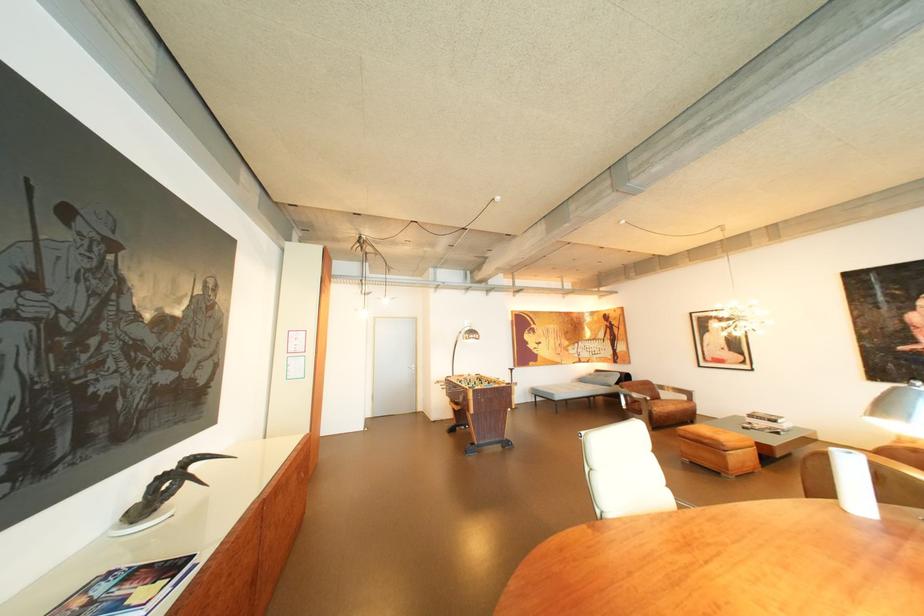
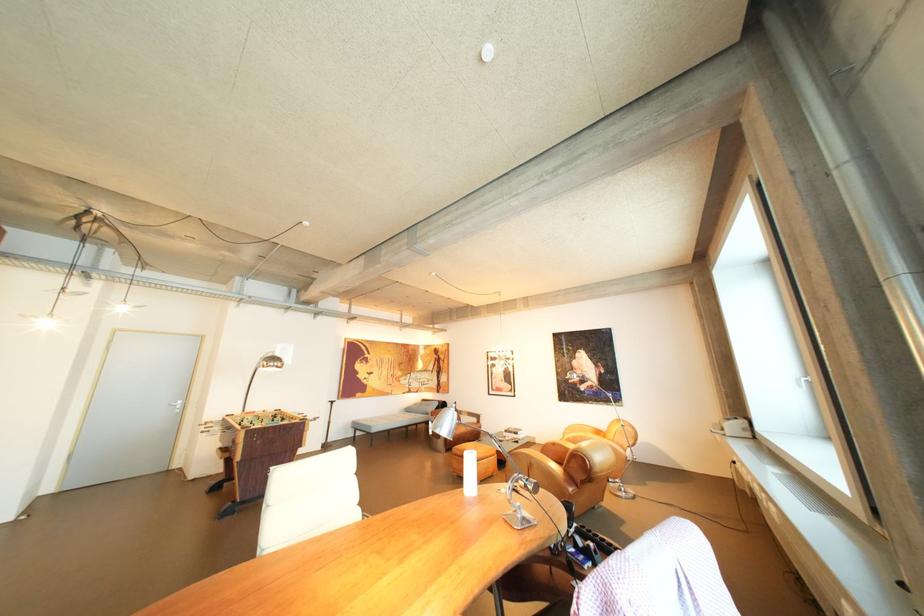
Question: Based on the continuous images, in which direction is the camera rotating? Reply with the corresponding letter.

Choices:
 (A) Left
 (B) Right
 (C) Up
 (D) Down

Answer: (B)